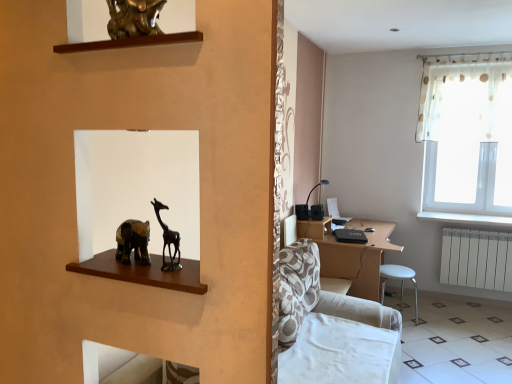
Question: Considering the positions of matte black table lamp at center-right and white plastic stool at lower right in the image, is matte black table lamp at center-right taller or shorter than white plastic stool at lower right?

Choices:
 (A) tall
 (B) short

Answer: (B)

Question: Based on their sizes in the image, would you say matte black table lamp at center-right is bigger or smaller than white plastic stool at lower right?

Choices:
 (A) big
 (B) small

Answer: (B)

Question: Which object is the farthest from the white plastic stool at lower right?

Choices:
 (A) white glossy tile at lower right
 (B) white plastic radiator at lower right
 (C) white painted wood at right
 (D) brown wooden desk at center
 (E) matte black table lamp at center-right

Answer: (E)

Question: Which is nearer to the white plastic stool at lower right?

Choices:
 (A) matte black table lamp at center-right
 (B) brown wooden desk at center
 (C) white glossy tile at lower right
 (D) white painted wood at right
 (E) white plastic radiator at lower right

Answer: (B)